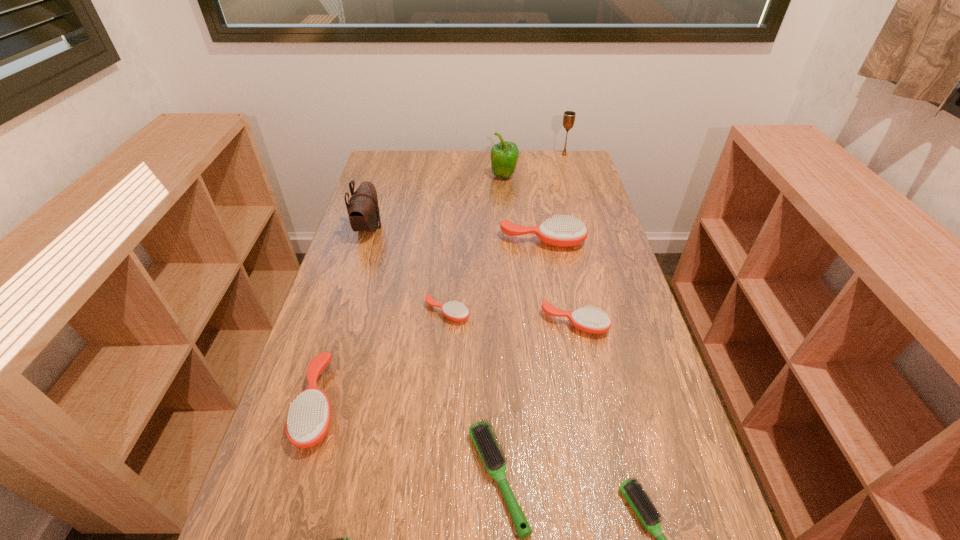
Where is `the farthest object`? This screenshot has height=540, width=960. the farthest object is located at coordinates (569, 116).

Locate an element on the screen. bell pepper is located at coordinates (504, 155).

What are the coordinates of `the ninth nearest object` in the screenshot? It's located at (504, 155).

Image resolution: width=960 pixels, height=540 pixels. I want to click on pouch, so click(363, 209).

At what (x,y) coordinates should I click in order to perform the action: click on the farthest hairbrush. Please return your answer as a coordinate pair (x, y). The image size is (960, 540). Looking at the image, I should click on (563, 231).

This screenshot has height=540, width=960. I want to click on the farthest orange hairbrush, so click(x=563, y=231).

I want to click on the sixth shortest object, so click(308, 420).

I want to click on the sixth shortest hairbrush, so click(308, 420).

Where is `the third tallest hairbrush`? the third tallest hairbrush is located at coordinates (589, 320).

The width and height of the screenshot is (960, 540). Identify the location of the third biggest orange hairbrush. (589, 320).